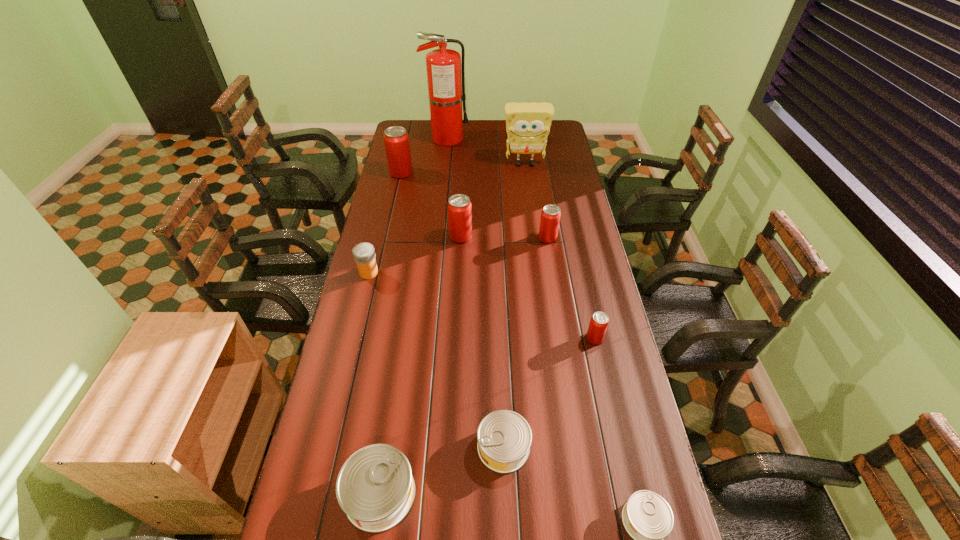
Find the location of a particular element. vacant space at the far edge of the desktop is located at coordinates (483, 137).

Where is `vacant space at the left edge`? vacant space at the left edge is located at coordinates (393, 328).

The width and height of the screenshot is (960, 540). In the image, there is a desktop. Find the location of `vacant space at the right edge`. vacant space at the right edge is located at coordinates (621, 448).

This screenshot has height=540, width=960. In the image, there is a desktop. Identify the location of free space at the far left corner. (425, 134).

In the image, there is a desktop. Where is `vacant space at the far right corner`? vacant space at the far right corner is located at coordinates (560, 132).

Find the location of `vacant region between the sponge and the ninth tallest object`. vacant region between the sponge and the ninth tallest object is located at coordinates (515, 306).

Where is `vacant space in between the leftmost silver can and the farthest can`? This screenshot has width=960, height=540. vacant space in between the leftmost silver can and the farthest can is located at coordinates tap(391, 333).

The width and height of the screenshot is (960, 540). In order to click on free area in between the ninth shortest object and the second silver can from right to left in this screenshot , I will do `click(515, 306)`.

Identify the location of vacant area that lies between the leftmost silver can and the second tallest object. pos(452,329).

Find the location of a particular element. The image size is (960, 540). free spot between the second biggest red can and the leftmost silver can is located at coordinates (420, 365).